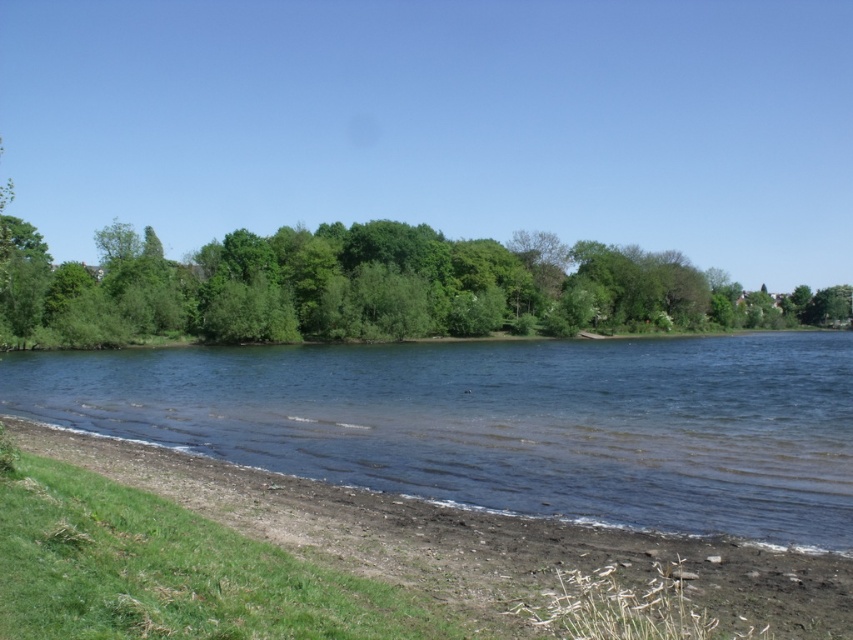
Does point (523, 508) come behind point (430, 257)?

No.

Who is more forward, (138, 380) or (428, 300)?

Point (138, 380) is in front.

You are a GUI agent. You are given a task and a screenshot of the screen. Output one action in this format:
    pyautogui.click(x=<x>, y=<y>)
    Task: Click on the clear water at center
    The height and width of the screenshot is (640, 853).
    Given the screenshot: What is the action you would take?
    pyautogui.click(x=503, y=422)

Between green leafy trees at center and brown dirt at lower center, which one is positioned higher?

green leafy trees at center is above.

This screenshot has height=640, width=853. I want to click on green leafy trees at center, so click(x=367, y=288).

This screenshot has height=640, width=853. What are the coordinates of `green leafy trees at center` in the screenshot? It's located at (367, 288).

At what (x,y) coordinates should I click in order to perform the action: click on clear water at center. Please return your answer as a coordinate pair (x, y). Looking at the image, I should click on (503, 422).

Who is positioned more to the left, clear water at center or brown dirt at lower center?

From the viewer's perspective, brown dirt at lower center appears more on the left side.

Which is in front, point (801, 349) or point (489, 529)?

Point (489, 529) is in front.

Identify the location of clear water at center. (503, 422).